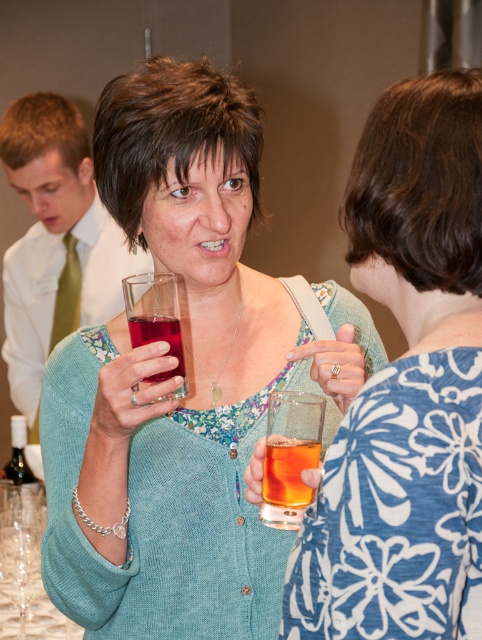
Looking at this image, between matte glass at center and translucent amber liquid at center, which one appears on the right side from the viewer's perspective?

translucent amber liquid at center

Which is behind, point (119, 99) or point (276, 468)?

Point (119, 99)

The width and height of the screenshot is (482, 640). Identify the location of matte glass at center. (181, 380).

Can you confirm if green silk tie at left is positioned below translucent amber liquid at center?

No.

Which is more to the right, green silk tie at left or translucent amber liquid at center?

translucent amber liquid at center is more to the right.

Between point (119, 285) and point (290, 456), which one is positioned in front?

Point (290, 456)

Where is `green silk tie at left`? The image size is (482, 640). green silk tie at left is located at coordinates (54, 243).

Does point (375, 582) lie in front of point (171, 276)?

Yes, point (375, 582) is closer to viewer.

Identify the location of translucent glass at center. The height and width of the screenshot is (640, 482). (406, 387).